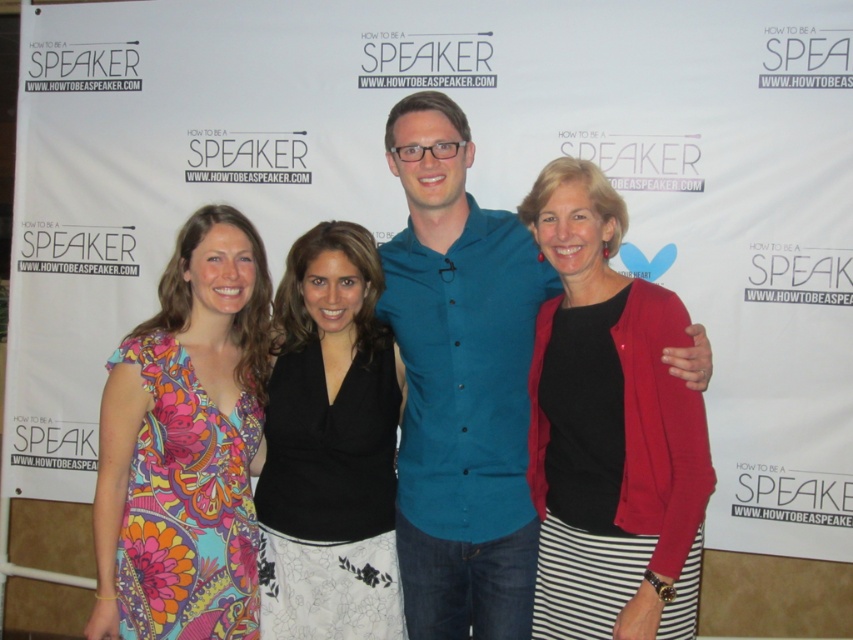
Between printed fabric dress at left and black matte shirt at center, which one has less height?

black matte shirt at center

Image resolution: width=853 pixels, height=640 pixels. Describe the element at coordinates (463, 340) in the screenshot. I see `printed fabric dress at left` at that location.

This screenshot has height=640, width=853. What are the coordinates of `printed fabric dress at left` in the screenshot? It's located at (463, 340).

Is point (106, 452) positioned before point (456, 173)?

Yes, it is in front of point (456, 173).

Which of these two, printed fabric dress at left or teal button-up shirt at center, stands shorter?

printed fabric dress at left

Measure the distance between point (503,358) and camera.

The distance of point (503,358) from camera is 7.44 feet.

Identify the location of printed fabric dress at left. The width and height of the screenshot is (853, 640). (463, 340).

Can you confirm if teal button-up shirt at center is bigger than floral print dress at left?

No.

Is teal button-up shirt at center to the right of floral print dress at left from the viewer's perspective?

Yes, teal button-up shirt at center is to the right of floral print dress at left.

Identify the location of teal button-up shirt at center. Image resolution: width=853 pixels, height=640 pixels. (460, 385).